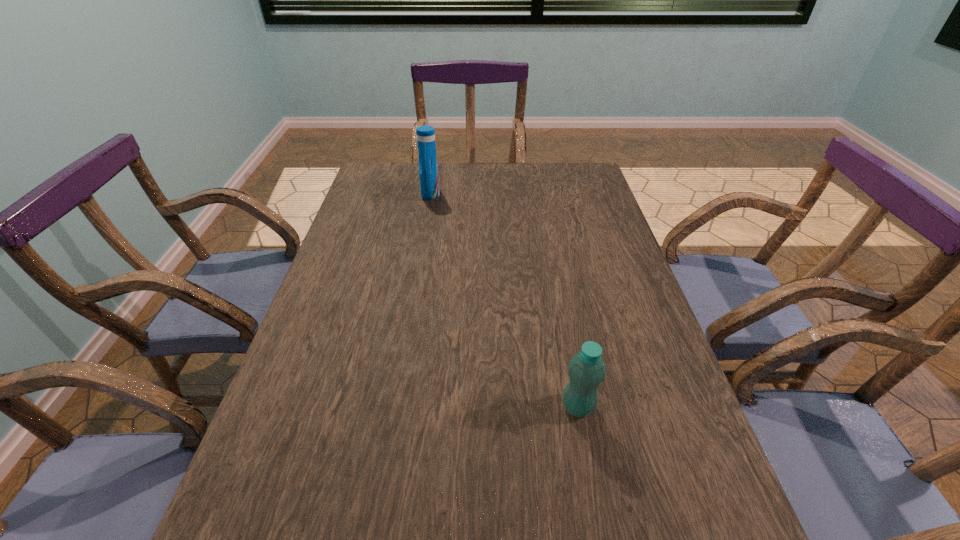
Locate an element on the screen. Image resolution: width=960 pixels, height=540 pixels. the farther object is located at coordinates (428, 170).

Image resolution: width=960 pixels, height=540 pixels. In order to click on the taller object in this screenshot , I will do `click(428, 170)`.

Find the location of a particular element. The image size is (960, 540). the nearer object is located at coordinates (587, 370).

Where is `water bottle`? water bottle is located at coordinates (587, 370).

Where is `vacant space located 0.070m on the front-facing side of the taller object`? The width and height of the screenshot is (960, 540). vacant space located 0.070m on the front-facing side of the taller object is located at coordinates (461, 193).

The width and height of the screenshot is (960, 540). In order to click on free space located at the front cap of the water bottle in this screenshot , I will do pyautogui.click(x=530, y=407).

You are a GUI agent. You are given a task and a screenshot of the screen. Output one action in this format:
    pyautogui.click(x=<x>, y=<y>)
    Task: Click on the vacant space located at the front cap of the water bottle
    This screenshot has height=540, width=960.
    Given the screenshot: What is the action you would take?
    pyautogui.click(x=510, y=407)

Locate an element on the screen. This screenshot has width=960, height=540. free space located 0.380m at the front cap of the water bottle is located at coordinates (367, 407).

At what (x,y) coordinates should I click in order to perform the action: click on object that is positioned at the far edge. Please return your answer as a coordinate pair (x, y). Image resolution: width=960 pixels, height=540 pixels. Looking at the image, I should click on (428, 170).

This screenshot has height=540, width=960. What are the coordinates of `free space at the far edge of the desktop` in the screenshot? It's located at (415, 190).